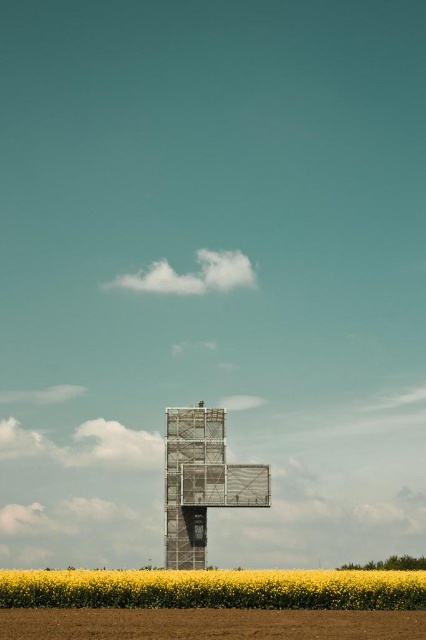
Is yellow matte flower at lower center behind brown soil at lower center?

Yes, yellow matte flower at lower center is further from the viewer.

Between yellow matte flower at lower center and brown soil at lower center, which one appears on the right side from the viewer's perspective?

Positioned to the right is brown soil at lower center.

Identify the location of yellow matte flower at lower center. This screenshot has width=426, height=640. (213, 588).

Find the location of `yellow matte flower at lower center`. yellow matte flower at lower center is located at coordinates (213, 588).

Can you confirm if brown soil at lower center is thinner than scaffolding metal cross at center?

No.

Find the location of a particular element. brown soil at lower center is located at coordinates (210, 624).

Locate an element on the screen. This screenshot has height=640, width=426. brown soil at lower center is located at coordinates (210, 624).

The image size is (426, 640). Describe the element at coordinates (213, 588) in the screenshot. I see `yellow matte flower at lower center` at that location.

Can you confirm if yellow matte flower at lower center is smaller than scaffolding metal cross at center?

No.

Where is `yellow matte flower at lower center`? The height and width of the screenshot is (640, 426). yellow matte flower at lower center is located at coordinates (213, 588).